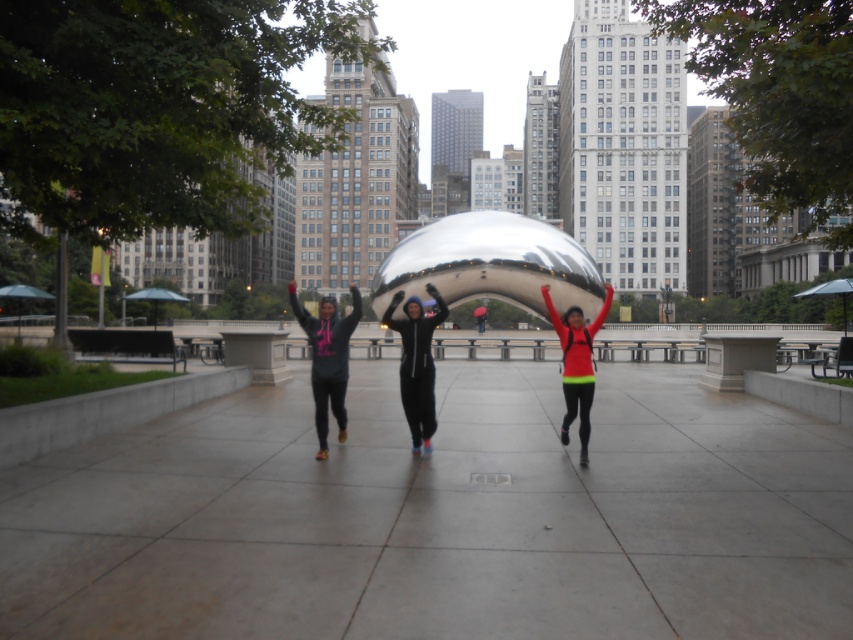
You are a photographer standing at the Cloud Gate sculpture in Millennium Park. You notice the gray concrete pavement at center and the neon green fabric at center in your viewfinder. Which object is positioned lower in the frame?

The gray concrete pavement at center is positioned below the neon green fabric at center, so it is lower in the frame.

You are a photographer standing at the base of Cloud Gate sculpture. You want to take a photo of the matte black hoodie at center and neon green jacket at center. If your camera has a maximum focus range of 50 meters, will both subjects be in focus?

The matte black hoodie at center is 45.43 meters away from neon green jacket at center. Since the camera can focus up to 50 meters, both subjects are within the focus range and will be in focus.